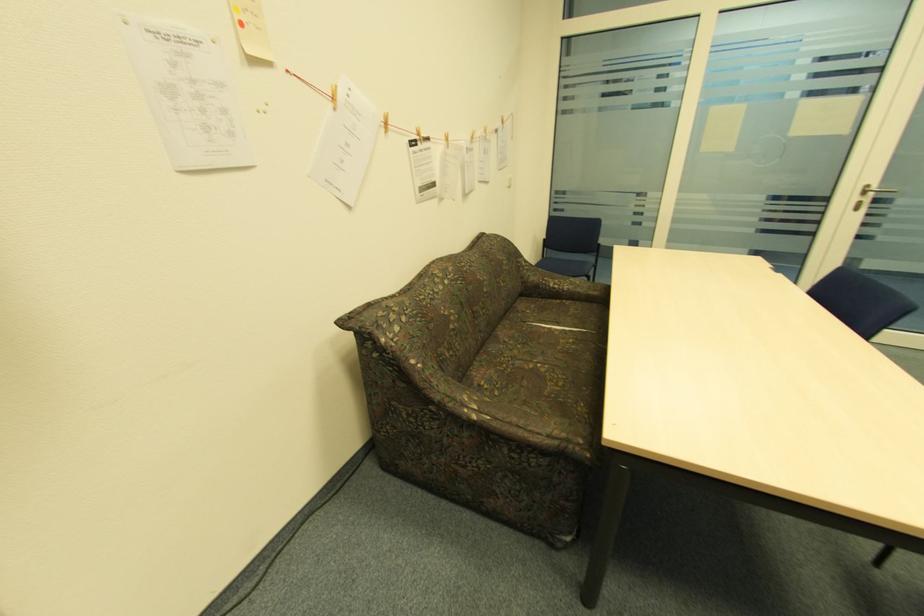
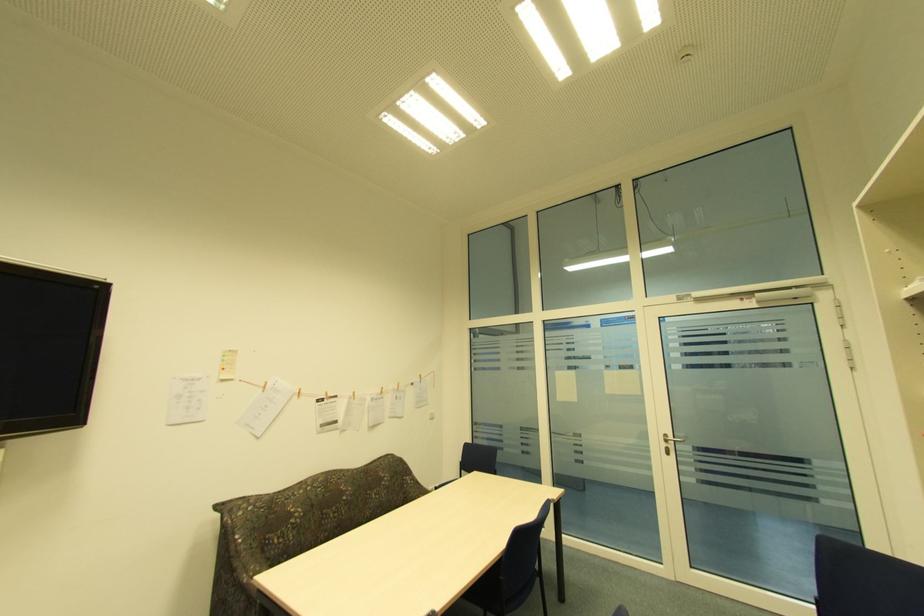
In the second image, find the point that corresponds to point 859,199 in the first image.

(666, 445)